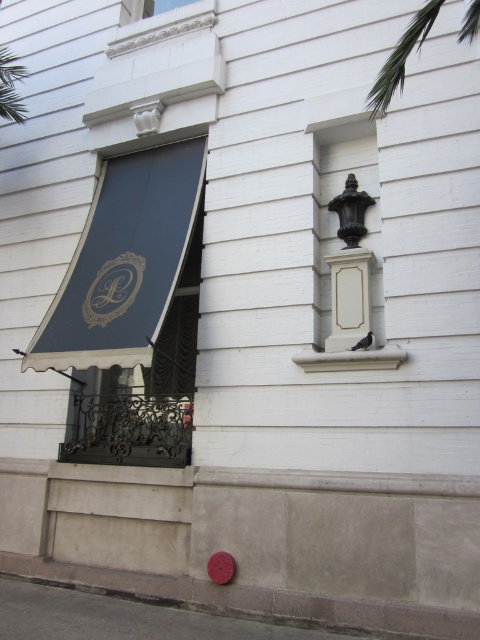
Looking at this image, can you confirm if dark blue fabric awning at left is shorter than green leafy palm tree at upper right?

Yes.

Is dark blue fabric awning at left further to camera compared to green leafy palm tree at upper right?

Yes, dark blue fabric awning at left is further from the viewer.

Find the location of a particular element. The image size is (480, 640). dark blue fabric awning at left is located at coordinates (175, 348).

The image size is (480, 640). What do you see at coordinates (400, 58) in the screenshot?
I see `green leafy palm tree at upper right` at bounding box center [400, 58].

Between point (468, 28) and point (379, 364), which one is positioned behind?

The point (379, 364) is more distant.

Describe the element at coordinates (400, 58) in the screenshot. This screenshot has height=640, width=480. I see `green leafy palm tree at upper right` at that location.

Where is `green leafy palm tree at upper right`? The width and height of the screenshot is (480, 640). green leafy palm tree at upper right is located at coordinates (400, 58).

Is dark blue fabric awning at left positioned in front of white stone window sill at center?

No, it is not.

Which is below, dark blue fabric awning at left or white stone window sill at center?

white stone window sill at center

Is point (170, 378) less distant than point (389, 355)?

No, it is behind (389, 355).

Where is `dark blue fabric awning at left`? Image resolution: width=480 pixels, height=640 pixels. dark blue fabric awning at left is located at coordinates (175, 348).